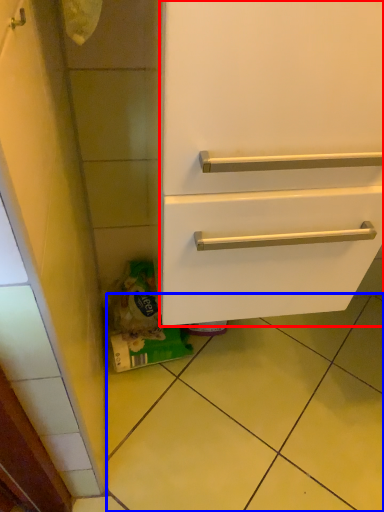
Question: Which object appears closest to the camera in this image, drawer (highlighted by a red box) or tile (highlighted by a blue box)?

Choices:
 (A) drawer
 (B) tile

Answer: (A)